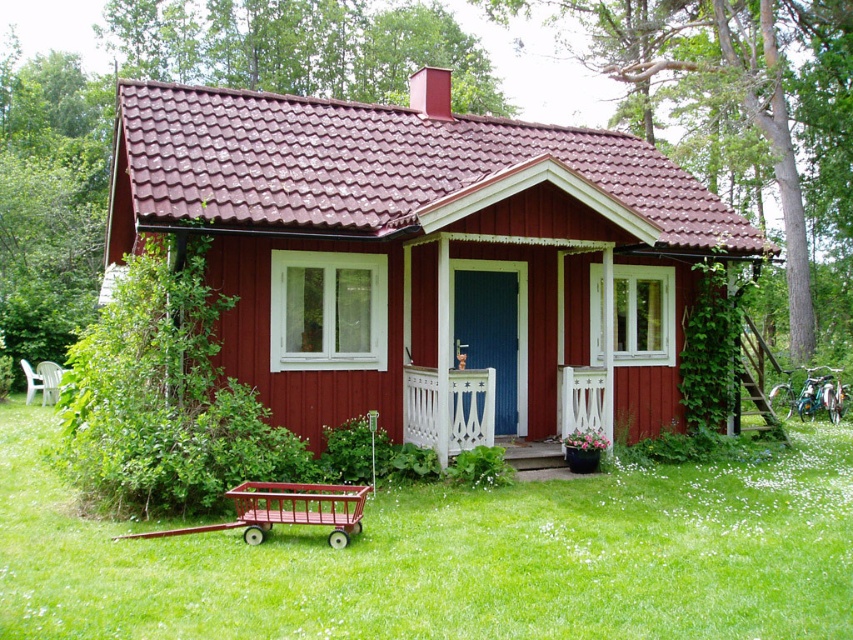
You are standing on the lawn in front of the house and want to walk to the smooth wooden cottage at center. Which direction should you face to move directly towards it from the metallic red wagon at lower left?

You should face to the right to move directly towards the smooth wooden cottage at center from the metallic red wagon at lower left because the smooth wooden cottage at center is located to the right of the metallic red wagon at lower left.

You are standing in front of the house and want to walk from the smooth wooden cottage at center to the white painted wood porch at center. In which direction should you move?

Since the smooth wooden cottage at center is to the left of the white painted wood porch at center, you should move to the right to reach the white painted wood porch at center from the smooth wooden cottage at center.